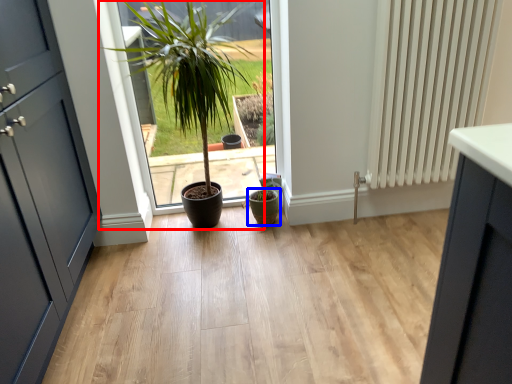
Question: Which object appears closest to the camera in this image, houseplant (highlighted by a red box) or flowerpot (highlighted by a blue box)?

Choices:
 (A) houseplant
 (B) flowerpot

Answer: (A)